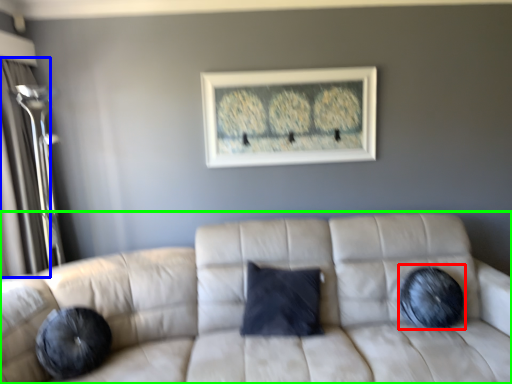
Question: Considering the real-world distances, which object is closest to pillow (highlighted by a red box)? glass door (highlighted by a blue box) or studio couch (highlighted by a green box).

Choices:
 (A) glass door
 (B) studio couch

Answer: (B)